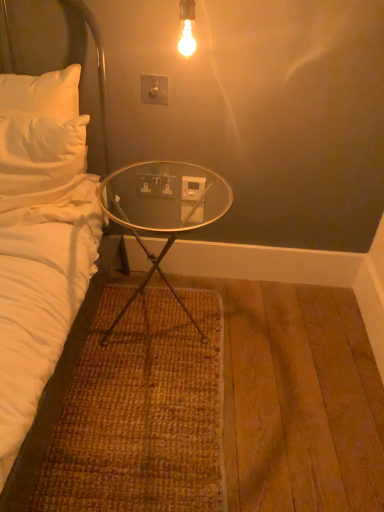
Question: From a real-world perspective, is white plastic electric outlet at center, marked as the 2th electric outlet in a top-to-bottom arrangement, beneath transparent glass table at center?

Choices:
 (A) no
 (B) yes

Answer: (A)

Question: Are white plastic electric outlet at center, positioned as the 1th electric outlet in bottom-to-top order, and transparent glass table at center far apart?

Choices:
 (A) no
 (B) yes

Answer: (A)

Question: Can you confirm if white plastic electric outlet at center, positioned as the 1th electric outlet in bottom-to-top order, is thinner than transparent glass table at center?

Choices:
 (A) yes
 (B) no

Answer: (A)

Question: Is white plastic electric outlet at center, which is the second electric outlet in front-to-back order, touching transparent glass table at center?

Choices:
 (A) no
 (B) yes

Answer: (A)

Question: Would you say transparent glass table at center is part of white plastic electric outlet at center, which appears as the 1th electric outlet when viewed from the back,'s contents?

Choices:
 (A) yes
 (B) no

Answer: (B)

Question: Does white plastic electric outlet at center, which is the second electric outlet in front-to-back order, have a larger size compared to transparent glass table at center?

Choices:
 (A) no
 (B) yes

Answer: (A)

Question: Considering the relative sizes of white plastic switch at upper center, placed as the 2th electric outlet when sorted from bottom to top, and transparent glass table at center in the image provided, is white plastic switch at upper center, placed as the 2th electric outlet when sorted from bottom to top, thinner than transparent glass table at center?

Choices:
 (A) no
 (B) yes

Answer: (B)

Question: Can you confirm if white plastic switch at upper center, placed as the 2th electric outlet when sorted from bottom to top, is positioned to the right of transparent glass table at center?

Choices:
 (A) no
 (B) yes

Answer: (A)

Question: From a real-world perspective, is white plastic switch at upper center, placed as the 2th electric outlet when sorted from bottom to top, on top of transparent glass table at center?

Choices:
 (A) no
 (B) yes

Answer: (B)

Question: Considering the relative sizes of white plastic switch at upper center, marked as the 1th electric outlet in a front-to-back arrangement, and transparent glass table at center in the image provided, is white plastic switch at upper center, marked as the 1th electric outlet in a front-to-back arrangement, smaller than transparent glass table at center?

Choices:
 (A) no
 (B) yes

Answer: (B)

Question: Can you confirm if white plastic switch at upper center, marked as the 1th electric outlet in a front-to-back arrangement, is bigger than transparent glass table at center?

Choices:
 (A) yes
 (B) no

Answer: (B)

Question: Is transparent glass table at center at the back of white plastic switch at upper center, placed as the 2th electric outlet when sorted from bottom to top?

Choices:
 (A) no
 (B) yes

Answer: (A)

Question: Is white plastic power outlet at center next to white plastic electric outlet at center, marked as the 2th electric outlet in a top-to-bottom arrangement?

Choices:
 (A) yes
 (B) no

Answer: (A)